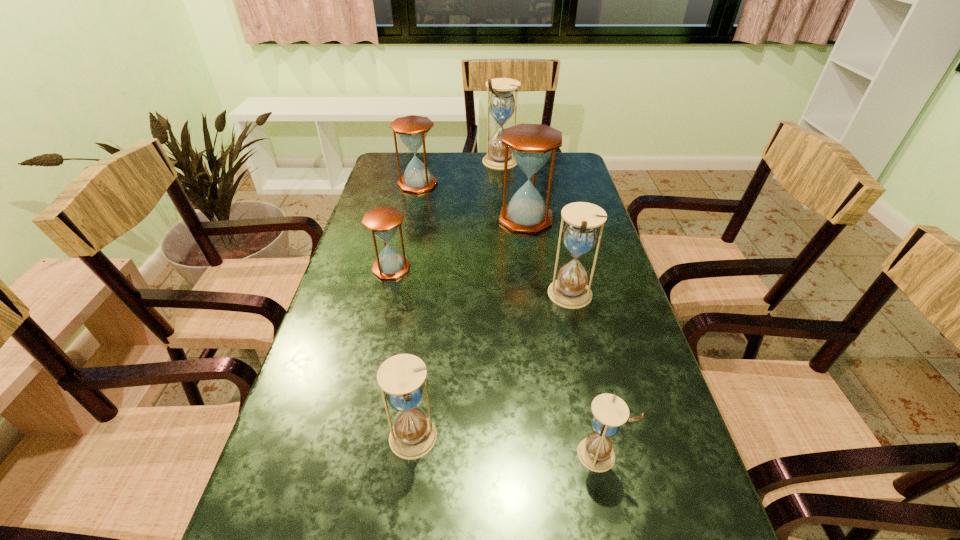
Image resolution: width=960 pixels, height=540 pixels. Identify the location of blank space located on the front of the third white hourglass from right to left. (505, 222).

This screenshot has height=540, width=960. Find the location of `vacant position located on the front of the fifth nearest object`. vacant position located on the front of the fifth nearest object is located at coordinates (541, 332).

Where is `free region located on the front of the second biggest white hourglass`? free region located on the front of the second biggest white hourglass is located at coordinates (588, 373).

Find the location of a particular element. The image size is (960, 540). vacant area located on the front of the second farthest object is located at coordinates (401, 261).

At what (x,y) coordinates should I click in order to perform the action: click on vacant region located on the back of the leftmost white hourglass. Please return your answer as a coordinate pair (x, y). Image resolution: width=960 pixels, height=540 pixels. Looking at the image, I should click on click(x=423, y=351).

You are a GUI agent. You are given a task and a screenshot of the screen. Output one action in this format:
    pyautogui.click(x=<x>, y=<y>)
    Task: Click on the free location located on the left of the smallest white hourglass
    Image resolution: width=960 pixels, height=540 pixels.
    Given the screenshot: What is the action you would take?
    pyautogui.click(x=534, y=454)

What are the coordinates of `free space located on the back of the nearest brown hourglass` in the screenshot? It's located at (403, 219).

Locate an element on the screen. The image size is (960, 540). object that is at the far left corner is located at coordinates (412, 130).

Where is `vacant space at the far edge`? This screenshot has height=540, width=960. vacant space at the far edge is located at coordinates (465, 154).

Locate an element on the screen. vacant area at the left edge is located at coordinates (305, 407).